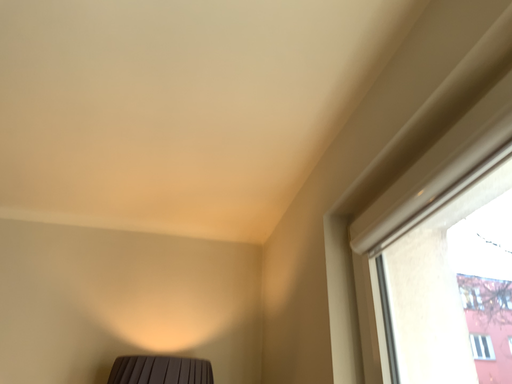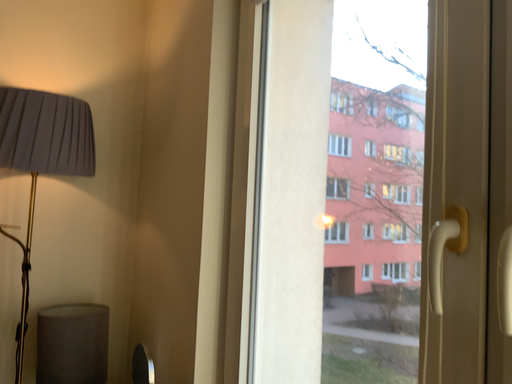
Question: How did the camera likely rotate when shooting the video?

Choices:
 (A) rotated downward
 (B) rotated upward

Answer: (A)